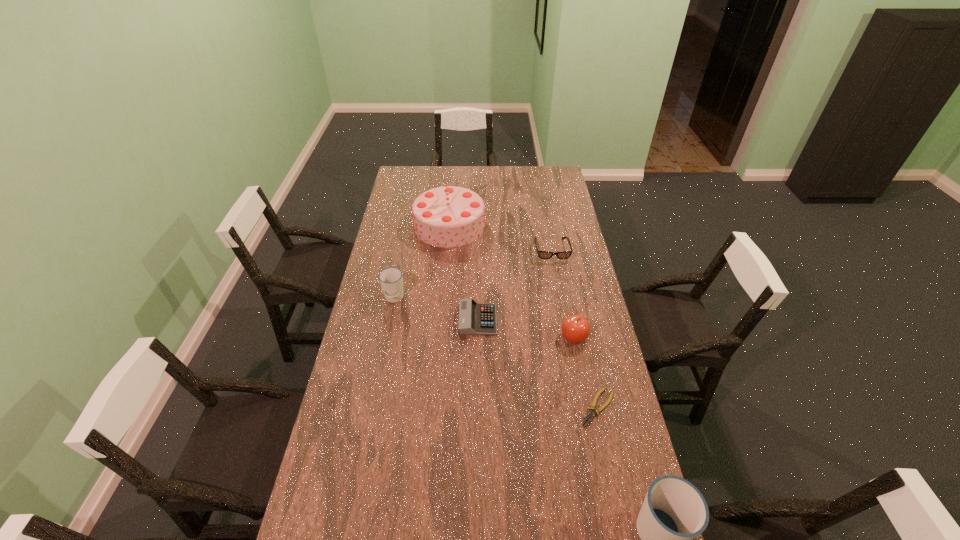
Locate an element on the screen. vacant space at the left edge of the desktop is located at coordinates (375, 260).

Where is `free space at the right edge`? free space at the right edge is located at coordinates (588, 421).

In the image, there is a desktop. Identify the location of vacant space at the far left corner. This screenshot has width=960, height=540. (419, 176).

Locate an element on the screen. This screenshot has height=540, width=960. blank space at the far right corner of the desktop is located at coordinates (539, 176).

Image resolution: width=960 pixels, height=540 pixels. I want to click on free area in between the birthday cake and the sixth tallest object, so click(464, 273).

Locate an element on the screen. The height and width of the screenshot is (540, 960). unoccupied position between the apple and the calculator is located at coordinates (526, 329).

Where is `free spot between the sixth farthest object and the calculator`? Image resolution: width=960 pixels, height=540 pixels. free spot between the sixth farthest object and the calculator is located at coordinates (538, 364).

I want to click on vacant space in between the shorter cup and the shortest object, so click(x=495, y=353).

At what (x,y) coordinates should I click in order to perform the action: click on object identified as the fifth closest to the shorter cup. Please return your answer as a coordinate pair (x, y). This screenshot has height=540, width=960. Looking at the image, I should click on (591, 414).

Locate which object is the fourth closest to the left cup. Please provide its 2D coordinates. Your answer should be formatted as a tuple, i.e. [(x, y)], where the tuple contains the x and y coordinates of a point satisfying the conditions above.

[(575, 328)]